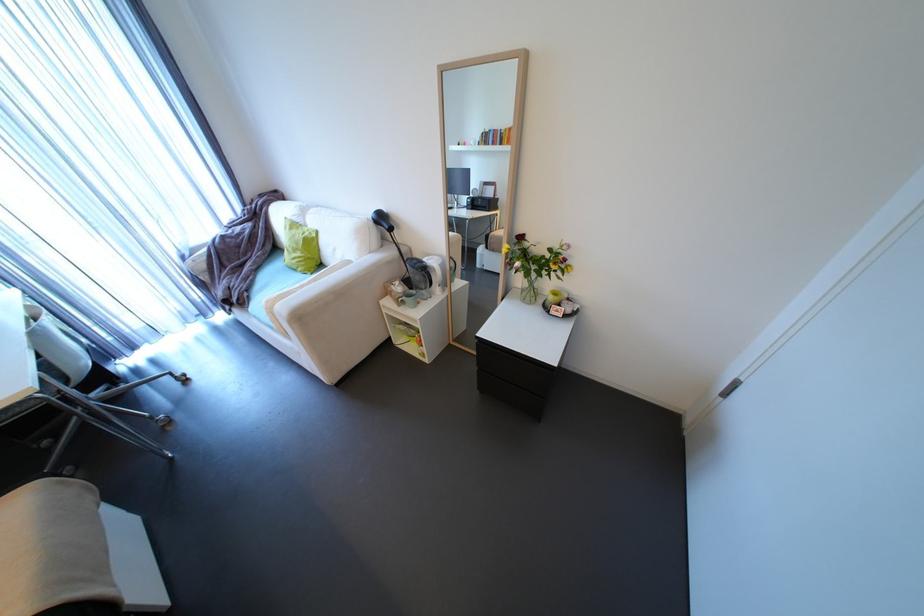
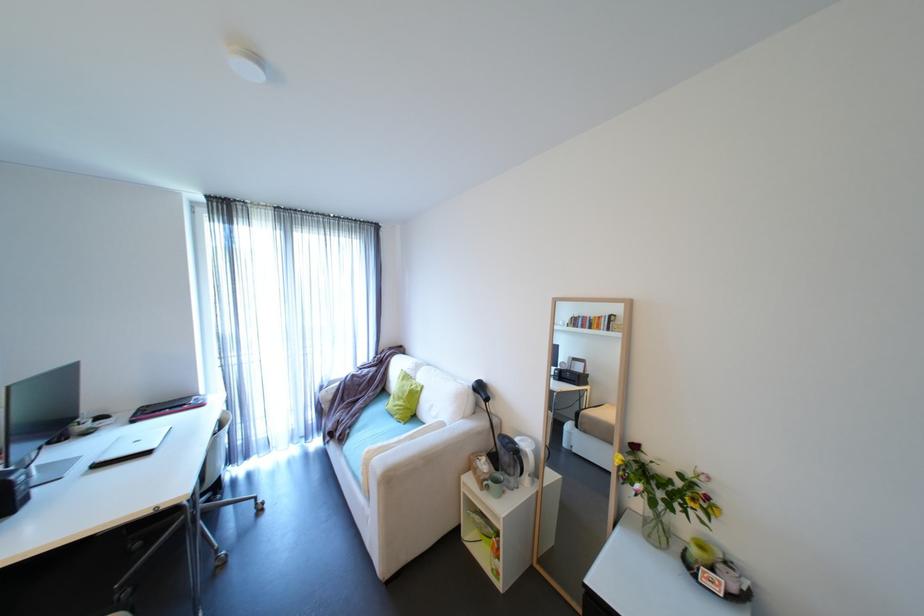
Where in the second image is the point corresponding to [407,292] from the first image?

(492, 471)